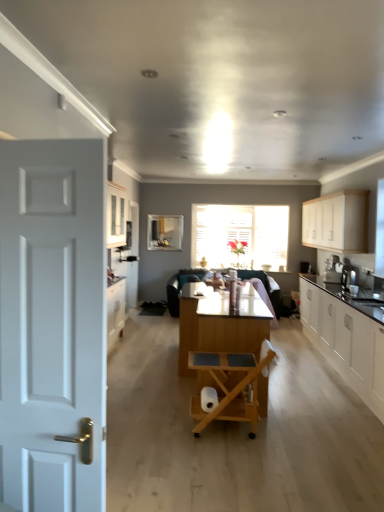
Describe the element at coordinates (346, 342) in the screenshot. I see `white glossy cabinets at right, acting as the 2th cabinetry starting from the top` at that location.

What do you see at coordinates (219, 323) in the screenshot?
I see `wooden table at center` at bounding box center [219, 323].

Locate an element on the screen. white matte cabinet at upper right, arranged as the 1th cabinetry when viewed from the top is located at coordinates (337, 222).

At what (x,y) coordinates should I click in order to perform the action: click on satin black coffee machine at right. Please return your answer as a coordinate pair (x, y). Looking at the image, I should click on (348, 276).

The image size is (384, 512). Describe the element at coordinates (240, 234) in the screenshot. I see `translucent glass window at center` at that location.

I want to click on white painted wood door at left, so click(53, 324).

From the image's perspective, would you say white matte cabinet at upper right, arranged as the 1th cabinetry when viewed from the top, is shown under satin black coffee machine at right?

Actually, white matte cabinet at upper right, arranged as the 1th cabinetry when viewed from the top, appears above satin black coffee machine at right in the image.

Considering the relative sizes of white matte cabinet at upper right, arranged as the 1th cabinetry when viewed from the top, and satin black coffee machine at right in the image provided, is white matte cabinet at upper right, arranged as the 1th cabinetry when viewed from the top, smaller than satin black coffee machine at right?

No.

Starting from the satin black coffee machine at right, which cabinetry is the 2nd one to the right? Please provide its 2D coordinates.

[(337, 222)]

The height and width of the screenshot is (512, 384). In order to click on window screen above the wooden rolling chair at center (from a real-world perspective) in this screenshot , I will do `click(165, 232)`.

Does clear glass window screen at center have a greater height compared to wooden rolling chair at center?

Yes, clear glass window screen at center is taller than wooden rolling chair at center.

Can you see clear glass window screen at center touching wooden rolling chair at center?

No.

Consider the image. Is clear glass window screen at center behind wooden rolling chair at center?

Yes, the depth of clear glass window screen at center is greater than that of wooden rolling chair at center.

Which object is further away from the camera, white glossy cabinets at right, acting as the 2th cabinetry starting from the top, or white matte cabinet at upper right, the second cabinetry when ordered from bottom to top?

white matte cabinet at upper right, the second cabinetry when ordered from bottom to top, is more distant.

Which is correct: white glossy cabinets at right, which is the 1th cabinetry in bottom-to-top order, is inside white matte cabinet at upper right, the second cabinetry when ordered from bottom to top, or outside of it?

white glossy cabinets at right, which is the 1th cabinetry in bottom-to-top order, exists outside the volume of white matte cabinet at upper right, the second cabinetry when ordered from bottom to top.

From the image's perspective, relative to white matte cabinet at upper right, the second cabinetry when ordered from bottom to top, is white glossy cabinets at right, which is the 1th cabinetry in bottom-to-top order, above or below?

white glossy cabinets at right, which is the 1th cabinetry in bottom-to-top order, is below white matte cabinet at upper right, the second cabinetry when ordered from bottom to top.

Does white glossy cabinets at right, acting as the 2th cabinetry starting from the top, appear on the left side of white matte cabinet at upper right, arranged as the 1th cabinetry when viewed from the top?

Indeed, white glossy cabinets at right, acting as the 2th cabinetry starting from the top, is positioned on the left side of white matte cabinet at upper right, arranged as the 1th cabinetry when viewed from the top.

Based on the photo, how different are the orientations of satin black coffee machine at right and white painted wood door at left in degrees?

They differ by 97.9 degrees in their facing directions.

Between satin black coffee machine at right and white painted wood door at left, which one has larger size?

Bigger between the two is white painted wood door at left.

Which of these two, satin black coffee machine at right or white painted wood door at left, stands shorter?

With less height is satin black coffee machine at right.

From a real-world perspective, is satin black coffee machine at right above or below white painted wood door at left?

In terms of real-world spatial position, satin black coffee machine at right is below white painted wood door at left.

Is white matte toilet paper at center situated inside white matte cabinet at upper right, the second cabinetry when ordered from bottom to top, or outside?

white matte toilet paper at center is spatially situated outside white matte cabinet at upper right, the second cabinetry when ordered from bottom to top.

Which of these two, white matte toilet paper at center or white matte cabinet at upper right, the second cabinetry when ordered from bottom to top, stands shorter?

Standing shorter between the two is white matte toilet paper at center.

Based on their sizes in the image, would you say white matte toilet paper at center is bigger or smaller than white matte cabinet at upper right, the second cabinetry when ordered from bottom to top?

In the image, white matte toilet paper at center appears to be smaller than white matte cabinet at upper right, the second cabinetry when ordered from bottom to top.

Can you confirm if clear glass window screen at center is taller than white matte toilet paper at center?

Yes.

From the image's perspective, is clear glass window screen at center above or below white matte toilet paper at center?

From the image's perspective, clear glass window screen at center appears above white matte toilet paper at center.

This screenshot has height=512, width=384. What are the coordinates of `toilet paper that is under the clear glass window screen at center (from a real-world perspective)` in the screenshot? It's located at (209, 399).

Can you confirm if clear glass window screen at center is positioned to the left of white matte toilet paper at center?

Yes.

Is clear glass window screen at center facing towards white glossy cabinets at right, acting as the 2th cabinetry starting from the top?

No, clear glass window screen at center is not facing towards white glossy cabinets at right, acting as the 2th cabinetry starting from the top.

Looking at this image, from the image's perspective, which is above, clear glass window screen at center or white glossy cabinets at right, which is the 1th cabinetry in bottom-to-top order?

clear glass window screen at center.

Between point (172, 238) and point (382, 346), which one is positioned in front?

The point (382, 346) is closer to the camera.

Find the location of `cabinetry behind the satin black coffee machine at right`. cabinetry behind the satin black coffee machine at right is located at coordinates (337, 222).

Identify the location of chair below the clear glass window screen at center (from a real-world perspective). (230, 386).

From the image, which object appears to be farther from wooden rolling chair at center, white glossy cabinets at right, acting as the 2th cabinetry starting from the top, or white painted wood door at left?

The object further to wooden rolling chair at center is white painted wood door at left.

Based on their spatial positions, is translucent glass window at center or clear glass window screen at center closer to wooden rolling chair at center?

Based on the image, clear glass window screen at center appears to be nearer to wooden rolling chair at center.

Considering their positions, is wooden rolling chair at center positioned further to translucent glass window at center than white matte toilet paper at center?

The object further to translucent glass window at center is white matte toilet paper at center.

When comparing their distances from wooden table at center, does satin black coffee machine at right or white glossy cabinets at right, which is the 1th cabinetry in bottom-to-top order, seem closer?

The object closer to wooden table at center is white glossy cabinets at right, which is the 1th cabinetry in bottom-to-top order.

Based on the photo, based on their spatial positions, is clear glass window screen at center or white painted wood door at left closer to white glossy cabinets at right, which is the 1th cabinetry in bottom-to-top order?

white painted wood door at left lies closer to white glossy cabinets at right, which is the 1th cabinetry in bottom-to-top order, than the other object.

When comparing their distances from white matte toilet paper at center, does wooden table at center or wooden rolling chair at center seem closer?

wooden rolling chair at center is closer to white matte toilet paper at center.

From the image, which object appears to be nearer to wooden table at center, white matte toilet paper at center or white matte cabinet at upper right, arranged as the 1th cabinetry when viewed from the top?

white matte toilet paper at center is closer to wooden table at center.

Based on their spatial positions, is wooden table at center or clear glass window screen at center further from white painted wood door at left?

The object further to white painted wood door at left is clear glass window screen at center.

This screenshot has height=512, width=384. In order to click on coffee machine between white glossy cabinets at right, which is the 1th cabinetry in bottom-to-top order, and clear glass window screen at center, along the z-axis in this screenshot , I will do `click(348, 276)`.

This screenshot has width=384, height=512. In order to click on coffee machine between white painted wood door at left and clear glass window screen at center in the front-back direction in this screenshot , I will do `click(348, 276)`.

At what (x,y) coordinates should I click in order to perform the action: click on table located between wooden rolling chair at center and white glossy cabinets at right, acting as the 2th cabinetry starting from the top, in the left-right direction. Please return your answer as a coordinate pair (x, y). Image resolution: width=384 pixels, height=512 pixels. Looking at the image, I should click on click(219, 323).

You are a GUI agent. You are given a task and a screenshot of the screen. Output one action in this format:
    pyautogui.click(x=<x>, y=<y>)
    Task: Click on the coffee machine between wooden rolling chair at center and clear glass window screen at center along the z-axis
    Image resolution: width=384 pixels, height=512 pixels.
    Given the screenshot: What is the action you would take?
    pyautogui.click(x=348, y=276)